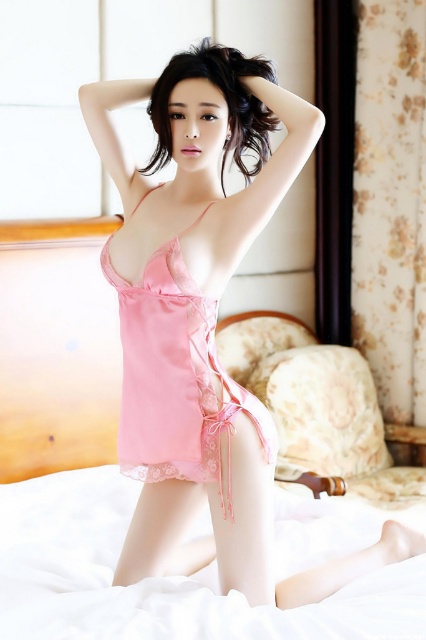
Does matte pink lingerie at center appear on the right side of pink satin dress at center?

Correct, you'll find matte pink lingerie at center to the right of pink satin dress at center.

Who is more distant from viewer, (233, 547) or (218, 449)?

Point (218, 449)

Locate an element on the screen. matte pink lingerie at center is located at coordinates (204, 323).

Does pink satin dress at center have a lesser height compared to sleek black hair at upper center?

No, pink satin dress at center is not shorter than sleek black hair at upper center.

Measure the distance from pink satin dress at center to sleek black hair at upper center.

pink satin dress at center is 50.69 centimeters from sleek black hair at upper center.

Where is `pink satin dress at center`? The height and width of the screenshot is (640, 426). pink satin dress at center is located at coordinates (175, 378).

Between matte pink lingerie at center and sleek black hair at upper center, which one appears on the left side from the viewer's perspective?

sleek black hair at upper center is more to the left.

Is matte pink lingerie at center closer to camera compared to sleek black hair at upper center?

That is False.

Is point (149, 305) farther from viewer compared to point (255, 125)?

No, it is not.

Where is `matte pink lingerie at center`? This screenshot has height=640, width=426. matte pink lingerie at center is located at coordinates pyautogui.click(x=204, y=323).